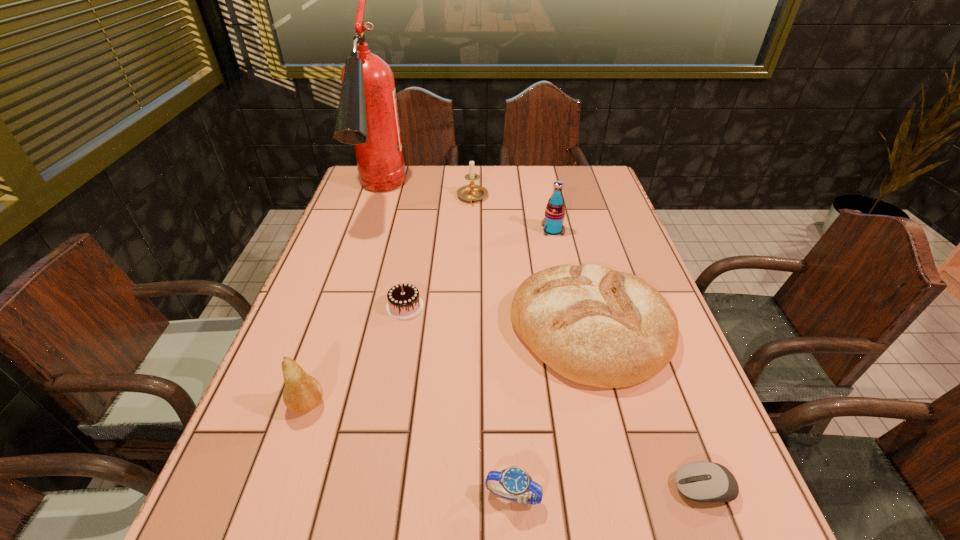
Where is `vacant point located on the back of the soda`? This screenshot has width=960, height=540. vacant point located on the back of the soda is located at coordinates (545, 193).

Locate an element on the screen. vacant space positioned 0.260m with a handle on the side of the candle holder is located at coordinates (471, 259).

Locate an element on the screen. Image resolution: width=960 pixels, height=540 pixels. vacant space located on the right of the pear is located at coordinates (516, 404).

You are a GUI agent. You are given a task and a screenshot of the screen. Output one action in this format:
    pyautogui.click(x=<x>, y=<y>)
    Task: Click on the vacant region located on the left of the fifth tallest object
    The height and width of the screenshot is (540, 960).
    Given the screenshot: What is the action you would take?
    pyautogui.click(x=379, y=329)

Identify the location of vacant space located 0.380m on the back of the chocolate cake. (422, 211).

The height and width of the screenshot is (540, 960). Identify the location of free location located on the left of the seventh tallest object. (375, 496).

In order to click on free space located on the wheel side of the computer equipment in this screenshot , I will do `click(626, 488)`.

The image size is (960, 540). I want to click on free region located 0.090m on the wheel side of the computer equipment, so click(620, 488).

Identify the location of vacant region located on the wheel side of the computer equipment. (578, 488).

This screenshot has width=960, height=540. I want to click on fire extinguisher at the far edge, so click(x=367, y=117).